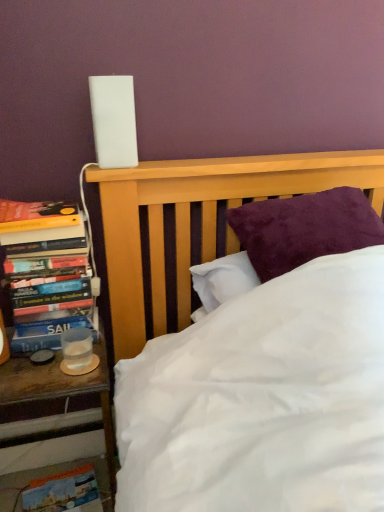
Question: Is hardcover books at left bigger or smaller than wooden nightstand at left?

Choices:
 (A) small
 (B) big

Answer: (A)

Question: Is hardcover books at left inside or outside of wooden nightstand at left?

Choices:
 (A) outside
 (B) inside

Answer: (A)

Question: Which object is the farthest from the wooden nightstand at left?

Choices:
 (A) clear plastic cup at left
 (B) hardcover books at left

Answer: (B)

Question: Which object is positioned farthest from the wooden nightstand at left?

Choices:
 (A) clear plastic cup at left
 (B) hardcover books at left

Answer: (B)